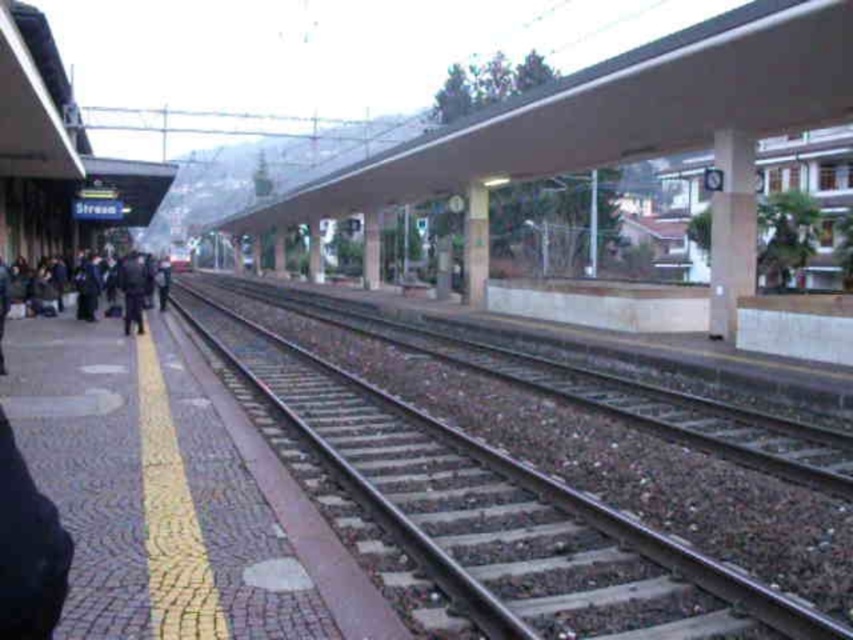
In the scene shown: Which is below, black metal track at center or smooth concrete pillar at center?

Positioned lower is black metal track at center.

Who is more forward, (514, 580) or (479, 250)?

Point (514, 580) is in front.

This screenshot has width=853, height=640. In order to click on black metal track at center in this screenshot , I will do `click(503, 515)`.

Who is lower down, concrete pillar at center or white concrete pillar at center?

concrete pillar at center is below.

Is point (718, 179) farther from viewer compared to point (368, 230)?

No, (718, 179) is closer to viewer.

Which is behind, point (718, 202) or point (364, 284)?

Point (364, 284)

Find the location of a particular element. Image resolution: width=853 pixels, height=640 pixels. concrete pillar at center is located at coordinates (730, 228).

Between point (747, 282) and point (132, 262), which one is positioned behind?

Point (747, 282)

Does concrete pillar at center appear over dark blue uniform at center?

Indeed, concrete pillar at center is positioned over dark blue uniform at center.

Which is behind, point (741, 273) or point (143, 324)?

The point (143, 324) is behind.

Where is `concrete pillar at center`? The width and height of the screenshot is (853, 640). concrete pillar at center is located at coordinates (730, 228).